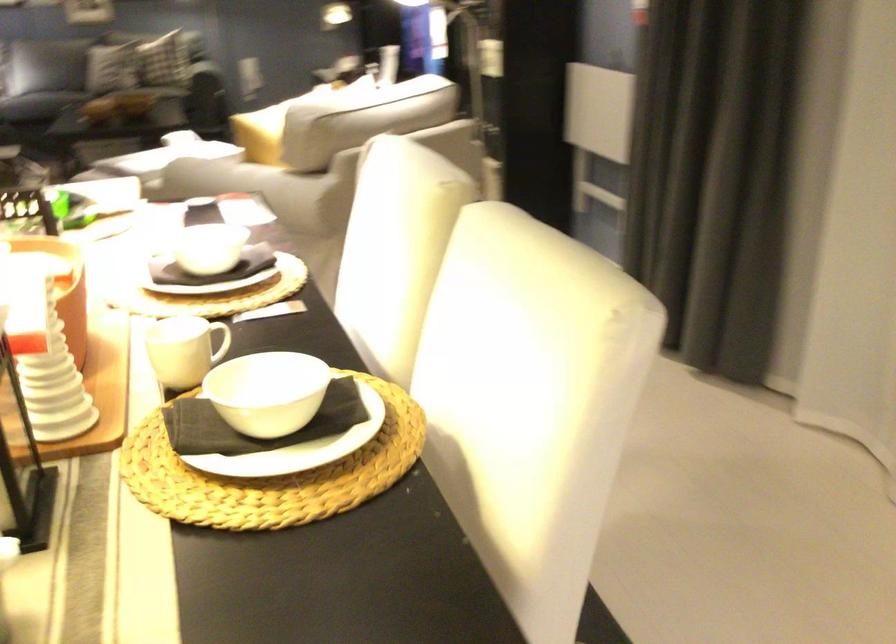
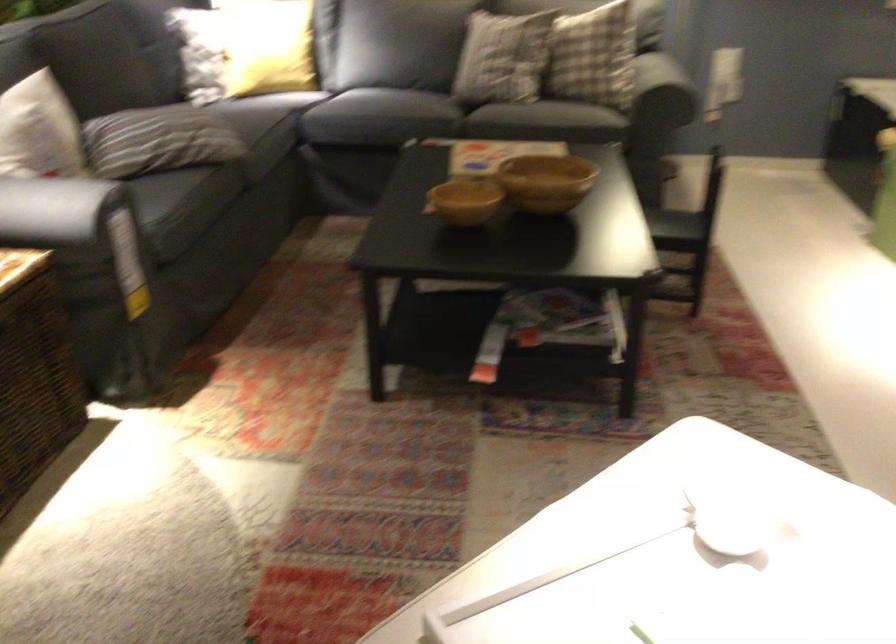
Which direction would the cameraman need to move to produce the second image?

The cameraman walked toward left, forward.